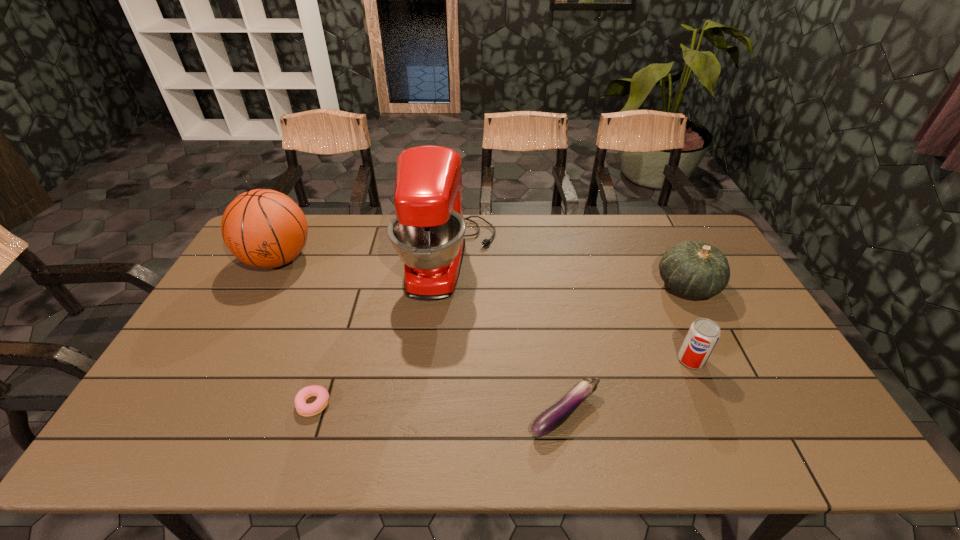
At what (x,y) coordinates should I click in order to perform the action: click on the fifth object from right to left. Please return your answer as a coordinate pair (x, y). Looking at the image, I should click on (303, 409).

You are a GUI agent. You are given a task and a screenshot of the screen. Output one action in this format:
    pyautogui.click(x=<x>, y=<y>)
    Task: Click on the vacant point located on the front-facing side of the kitchen mixer
    
    Given the screenshot: What is the action you would take?
    pyautogui.click(x=585, y=260)

Find the location of a particular element. free space located on the front of the fifth shortest object is located at coordinates (240, 330).

Where is `free space located 0.150m on the left of the fourth shortest object`? Image resolution: width=960 pixels, height=540 pixels. free space located 0.150m on the left of the fourth shortest object is located at coordinates (608, 286).

You are a GUI agent. You are given a task and a screenshot of the screen. Output one action in this format:
    pyautogui.click(x=<x>, y=<y>)
    Task: Click on the blank space located on the back of the soda
    
    Given the screenshot: What is the action you would take?
    tap(677, 328)

Find the location of a particular element. The width and height of the screenshot is (960, 540). free space located 0.310m on the back of the eggplant is located at coordinates (547, 301).

Where is `free space located 0.140m on the right of the second object from left to right`? Image resolution: width=960 pixels, height=540 pixels. free space located 0.140m on the right of the second object from left to right is located at coordinates (387, 404).

This screenshot has height=540, width=960. Find the location of `kitchen mixer that is at the far edge`. kitchen mixer that is at the far edge is located at coordinates (427, 232).

Where is `basketball positioned at the far edge`? basketball positioned at the far edge is located at coordinates coord(263,228).

Image resolution: width=960 pixels, height=540 pixels. Identify the location of object that is at the near edge. (556, 415).